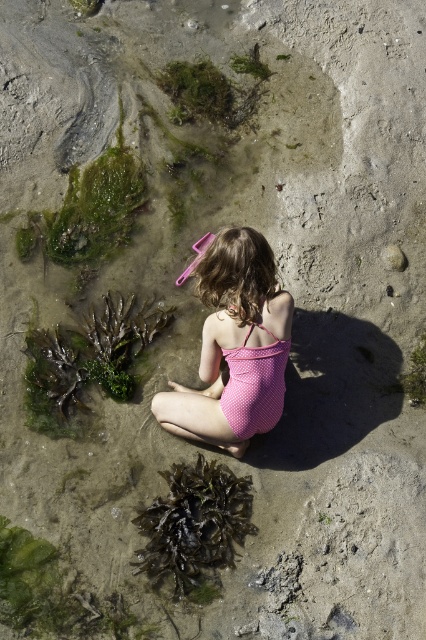
You are a parent supervising children at the beach and see the green mossy algae at lower left and the dark green seaweed at lower left. Which one is positioned higher up compared to the other?

The green mossy algae at lower left is positioned higher up compared to the dark green seaweed at lower left because it is located above it.